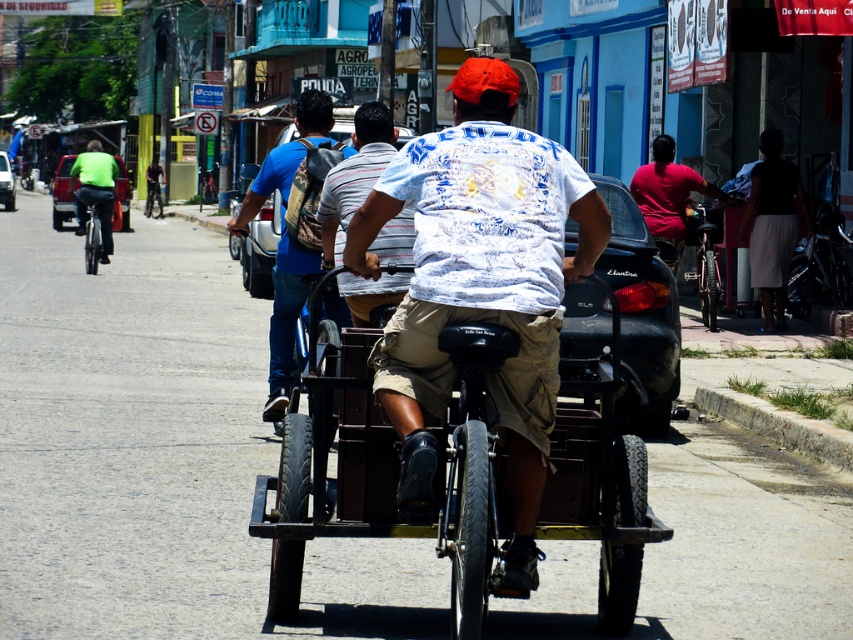
What are the coordinates of the white printed shirt at center?

The coordinates of the white printed shirt at center are at point [354,176].

You are a pedestrian standing at the edge of the street. You see the metallic black rickshaw at center and the white printed shirt at center. Which object is located to the right of the other?

The metallic black rickshaw at center is positioned on the right side of white printed shirt at center.

You are a pedestrian standing on the street and see the metallic black rickshaw at center and the white printed shirt at center. Which object is nearer to you?

The metallic black rickshaw at center is closer to the viewer than the white printed shirt at center.